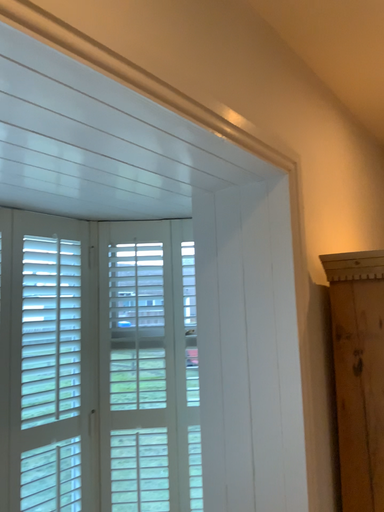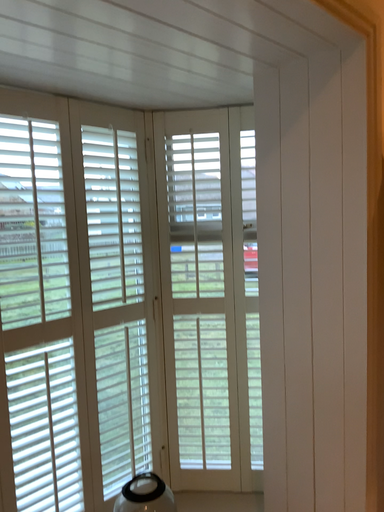
Question: How did the camera likely rotate when shooting the video?

Choices:
 (A) rotated right
 (B) rotated left

Answer: (B)